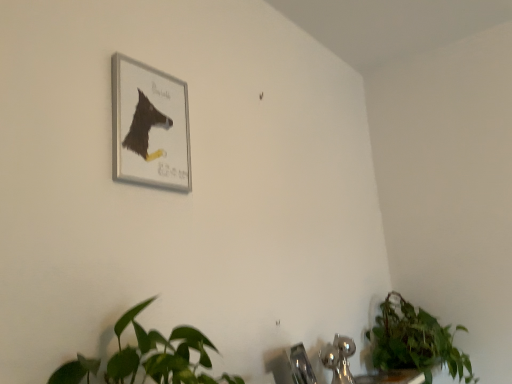
Question: Would you say green leafy plant at lower right is to the left or to the right of satin nickel faucet at lower center in the picture?

Choices:
 (A) left
 (B) right

Answer: (B)

Question: Considering the positions of point (418, 359) and point (305, 367), is point (418, 359) closer or farther from the camera than point (305, 367)?

Choices:
 (A) closer
 (B) farther

Answer: (B)

Question: Which of these objects is positioned farthest from the silver metallic picture frame at upper left?

Choices:
 (A) chrome metallic sink at lower center
 (B) satin nickel faucet at lower center
 (C) green leafy plant at lower right

Answer: (C)

Question: Which is nearer to the chrome metallic sink at lower center?

Choices:
 (A) silver metallic picture frame at upper left
 (B) green leafy plant at lower right
 (C) satin nickel faucet at lower center

Answer: (C)